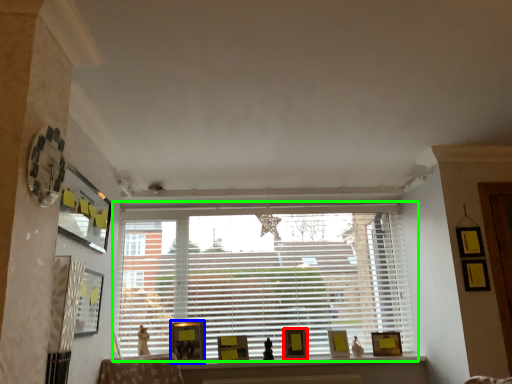
Question: Considering the real-world distances, which object is closest to picture frame (highlighted by a red box)? picture frame (highlighted by a blue box) or window (highlighted by a green box).

Choices:
 (A) picture frame
 (B) window

Answer: (B)